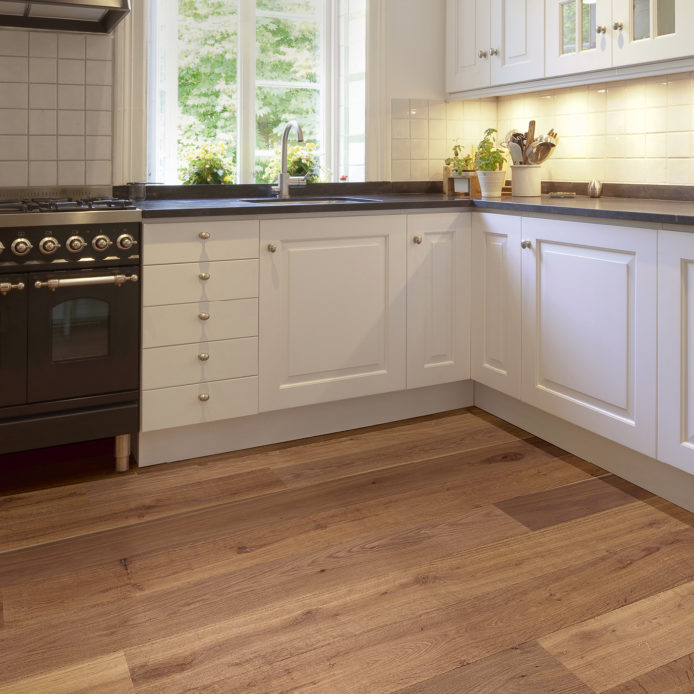
Image resolution: width=694 pixels, height=694 pixels. I want to click on extractor fan, so click(x=62, y=19).